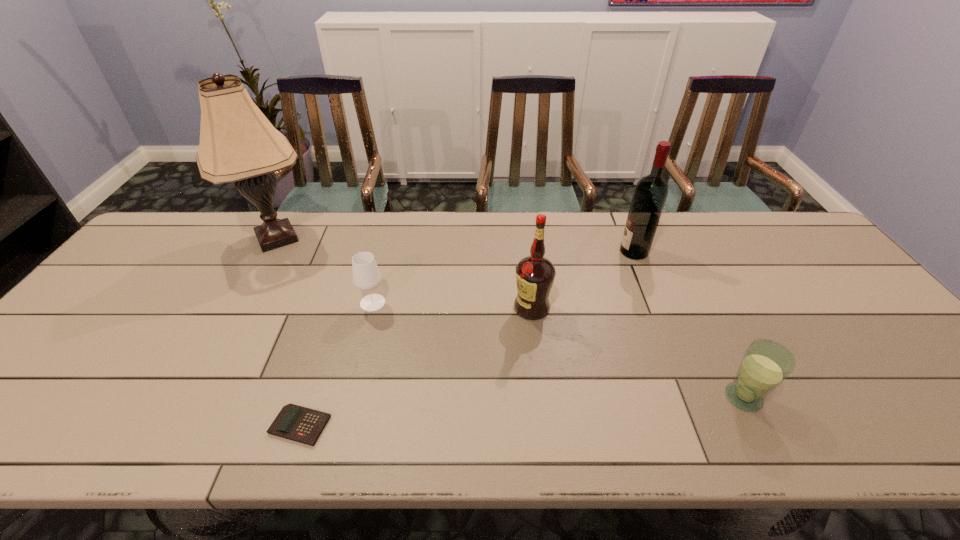
Identify the location of lamp present at the far edge. The height and width of the screenshot is (540, 960). (238, 144).

Image resolution: width=960 pixels, height=540 pixels. In order to click on alcohol located at the far edge in this screenshot , I will do `click(651, 191)`.

Where is `glass situated at the near edge`? Image resolution: width=960 pixels, height=540 pixels. glass situated at the near edge is located at coordinates click(765, 364).

You are a GUI agent. You are given a task and a screenshot of the screen. Output one action in this format:
    pyautogui.click(x=<x>, y=<y>)
    Task: Click on the calculator present at the near edge
    
    Given the screenshot: What is the action you would take?
    pyautogui.click(x=304, y=425)

At what (x,y) coordinates should I click in order to perform the action: click on vacant point at the far edge. Please return your answer as a coordinate pair (x, y). The width and height of the screenshot is (960, 540). Looking at the image, I should click on (420, 230).

Where is `vacant space at the near edge of the desktop`? This screenshot has width=960, height=540. vacant space at the near edge of the desktop is located at coordinates (739, 433).

You are a GUI agent. You are given a task and a screenshot of the screen. Output one action in this format:
    pyautogui.click(x=<x>, y=<y>)
    Task: Click on the vacant space at the left edge of the desktop
    The height and width of the screenshot is (540, 960).
    Given the screenshot: What is the action you would take?
    pyautogui.click(x=149, y=299)

The image size is (960, 540). What are the coordinates of `vacant space at the right edge` in the screenshot? It's located at (878, 332).

The image size is (960, 540). What are the coordinates of `vacant position at the far right corner of the desktop` in the screenshot? It's located at (801, 237).

The height and width of the screenshot is (540, 960). Find the location of `unoccupied position between the nearer glass and the shortest object`. unoccupied position between the nearer glass and the shortest object is located at coordinates (521, 411).